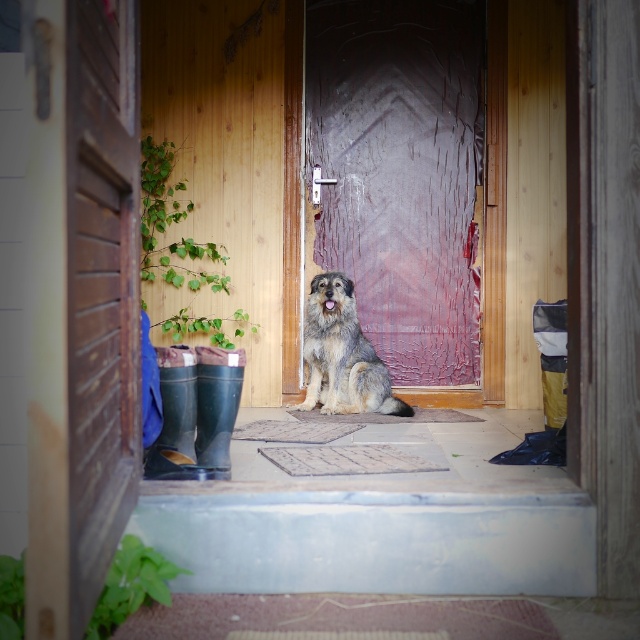
Question: Which of the following is the closest to the observer?

Choices:
 (A) rustic wood door at left
 (B) wooden screen door at center
 (C) gray-furred dog at center

Answer: (A)

Question: Is wooden screen door at center to the right of rustic wood door at left from the viewer's perspective?

Choices:
 (A) yes
 (B) no

Answer: (A)

Question: Is rustic wood door at left to the left of gray-furred dog at center from the viewer's perspective?

Choices:
 (A) no
 (B) yes

Answer: (B)

Question: Among these points, which one is farthest from the camera?

Choices:
 (A) (472, 364)
 (B) (116, 356)
 (C) (404, 410)

Answer: (A)

Question: Observing the image, what is the correct spatial positioning of wooden screen door at center in reference to rustic wood door at left?

Choices:
 (A) above
 (B) below

Answer: (A)

Question: Which object is farther from the camera taking this photo?

Choices:
 (A) gray-furred dog at center
 (B) rustic wood door at left
 (C) wooden screen door at center

Answer: (C)